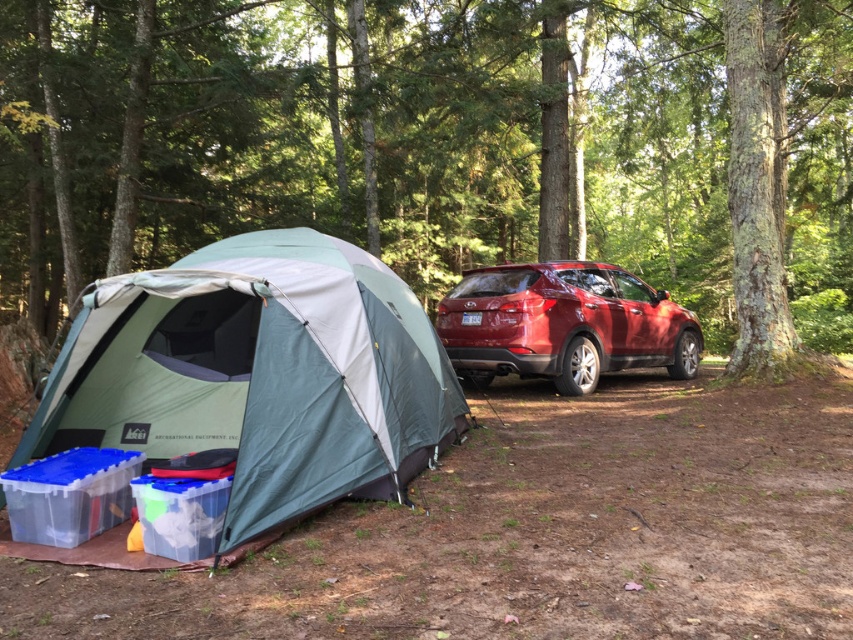
You are a hiker who wants to take a photo of the shiny red suv at center and the green textured tree at center from a distance. Which object will appear bigger in the photo?

The green textured tree at center will appear bigger in the photo because it is larger in size than the shiny red suv at center.

You are a hiker planning to set up a tent in a wooded area. You have a green fabric tent at left and a shiny red suv at center. Which object takes up more space in the scene?

The green fabric tent at left is bigger than the shiny red suv at center, so it takes up more space in the scene.

You are a camper who wants to set up a hammock between the green textured tree at center and the green fabric tent at left. Based on the scene, which object would you need to adjust the height of the hammock to match?

The green textured tree at center is much taller than the green fabric tent at left, so you would need to adjust the hammock height to match the shorter green fabric tent at left.